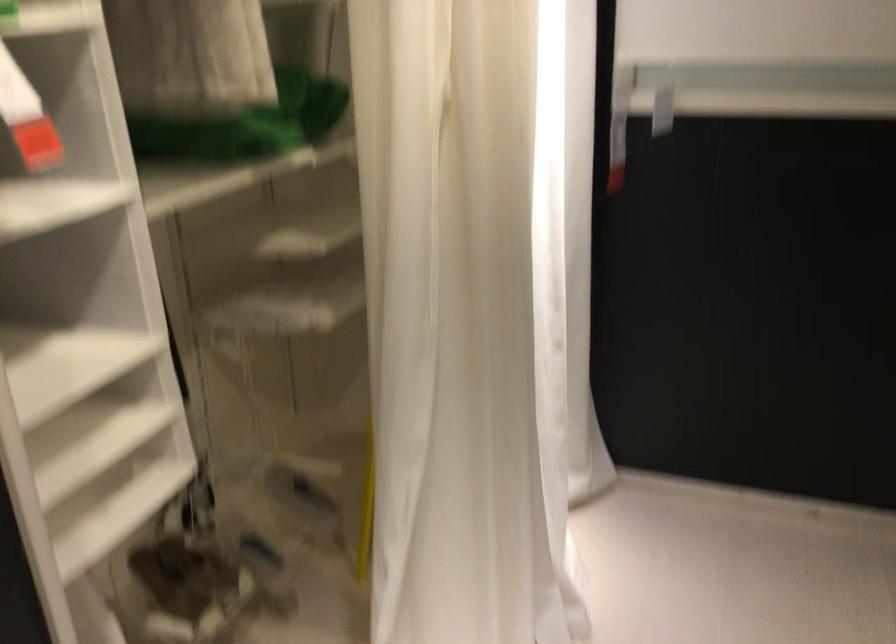
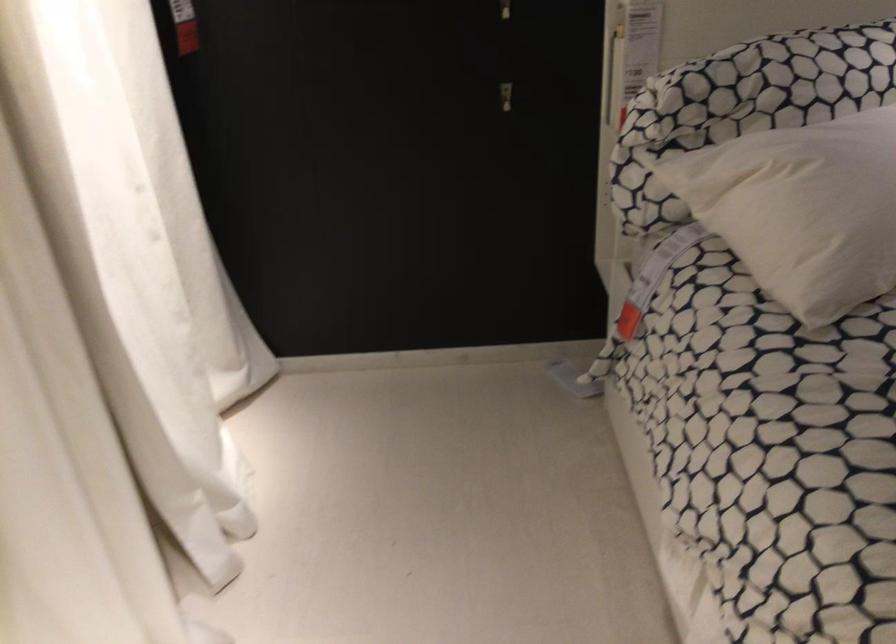
Question: The images are taken continuously from a first-person perspective. In which direction are you moving?

Choices:
 (A) Left
 (B) Right
 (C) Forward
 (D) Backward

Answer: (B)